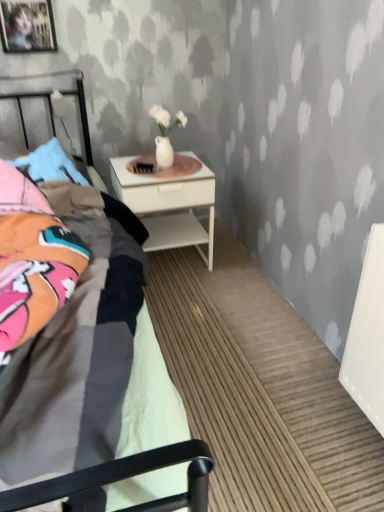
Question: Looking at the image, does white textured wall at upper center seem bigger or smaller compared to white glossy nightstand at center?

Choices:
 (A) small
 (B) big

Answer: (B)

Question: In terms of height, does white textured wall at upper center look taller or shorter compared to white glossy nightstand at center?

Choices:
 (A) short
 (B) tall

Answer: (B)

Question: Which of these objects is positioned farthest from the white glossy nightstand at center?

Choices:
 (A) white textured wall at upper center
 (B) wooden picture frame at upper left

Answer: (B)

Question: Which object is the farthest from the white glossy nightstand at center?

Choices:
 (A) wooden picture frame at upper left
 (B) white textured wall at upper center

Answer: (A)